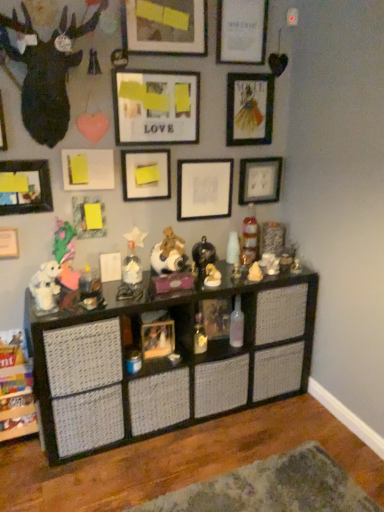
Question: Does clear plastic bottle at center, which appears as the second toy when viewed from the right, have a larger size compared to white matte dog at center, arranged as the fifth toy when viewed from the right?

Choices:
 (A) yes
 (B) no

Answer: (A)

Question: Is clear plastic bottle at center, the tenth toy when ordered from left to right, facing towards white matte dog at center, arranged as the fifth toy when viewed from the right?

Choices:
 (A) no
 (B) yes

Answer: (A)

Question: Could white matte dog at center, arranged as the fifth toy when viewed from the right, be considered to be inside clear plastic bottle at center, the tenth toy when ordered from left to right?

Choices:
 (A) yes
 (B) no

Answer: (B)

Question: Is clear plastic bottle at center, the tenth toy when ordered from left to right, not near white matte dog at center, which appears as the seventh toy when viewed from the left?

Choices:
 (A) no
 (B) yes

Answer: (A)

Question: From a real-world perspective, is clear plastic bottle at center, the tenth toy when ordered from left to right, below white matte dog at center, arranged as the fifth toy when viewed from the right?

Choices:
 (A) no
 (B) yes

Answer: (A)

Question: Can we say clear plastic bottle at center, which appears as the second toy when viewed from the right, lies outside white matte dog at center, which appears as the seventh toy when viewed from the left?

Choices:
 (A) no
 (B) yes

Answer: (B)

Question: Is wooden picture frame at center, the thirteenth picture frame when ordered from top to bottom, outside matte yellow paper at center, which is counted as the seventh picture frame, starting from the top?

Choices:
 (A) no
 (B) yes

Answer: (B)

Question: From the image's perspective, is wooden picture frame at center, the thirteenth picture frame when ordered from top to bottom, on matte yellow paper at center, acting as the 7th picture frame starting from the bottom?

Choices:
 (A) yes
 (B) no

Answer: (B)

Question: Can you confirm if wooden picture frame at center, the thirteenth picture frame when ordered from top to bottom, is thinner than matte yellow paper at center, acting as the 7th picture frame starting from the bottom?

Choices:
 (A) yes
 (B) no

Answer: (B)

Question: Is wooden picture frame at center, which appears as the 1th picture frame when ordered from the bottom, turned away from matte yellow paper at center, which is counted as the seventh picture frame, starting from the top?

Choices:
 (A) yes
 (B) no

Answer: (B)

Question: Can you confirm if wooden picture frame at center, the thirteenth picture frame when ordered from top to bottom, is positioned to the right of matte yellow paper at center, which is counted as the seventh picture frame, starting from the top?

Choices:
 (A) no
 (B) yes

Answer: (B)

Question: Considering the relative sizes of wooden picture frame at center, the thirteenth picture frame when ordered from top to bottom, and matte yellow paper at center, which is counted as the seventh picture frame, starting from the top, in the image provided, is wooden picture frame at center, the thirteenth picture frame when ordered from top to bottom, smaller than matte yellow paper at center, which is counted as the seventh picture frame, starting from the top,?

Choices:
 (A) yes
 (B) no

Answer: (B)

Question: From the image's perspective, is matte white picture frame at lower left, the eleventh picture frame positioned from the top, located beneath matte black picture frame at upper center, marked as the 12th picture frame in a bottom-to-top arrangement?

Choices:
 (A) no
 (B) yes

Answer: (B)